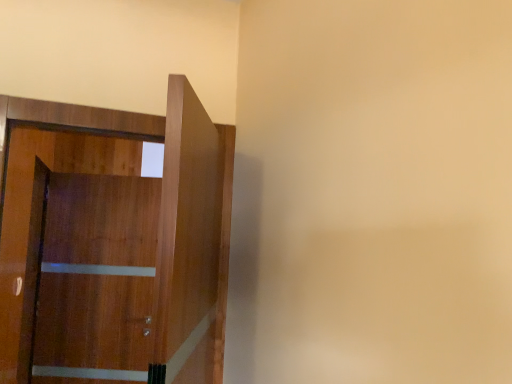
Question: Considering the positions of wooden barn door at left and wooden door at left in the image, is wooden barn door at left bigger or smaller than wooden door at left?

Choices:
 (A) small
 (B) big

Answer: (B)

Question: Considering their positions, is wooden barn door at left located in front of or behind wooden door at left?

Choices:
 (A) behind
 (B) front

Answer: (A)

Question: Is wooden barn door at left spatially inside wooden door at left, or outside of it?

Choices:
 (A) inside
 (B) outside

Answer: (B)

Question: Is point pos(220,294) closer or farther from the camera than point pos(105,317)?

Choices:
 (A) closer
 (B) farther

Answer: (A)

Question: Do you think wooden door at left is within wooden barn door at left, or outside of it?

Choices:
 (A) outside
 (B) inside

Answer: (A)

Question: From a real-world perspective, relative to wooden barn door at left, is wooden door at left vertically above or below?

Choices:
 (A) above
 (B) below

Answer: (A)

Question: In the image, is wooden door at left on the left side or the right side of wooden barn door at left?

Choices:
 (A) left
 (B) right

Answer: (B)